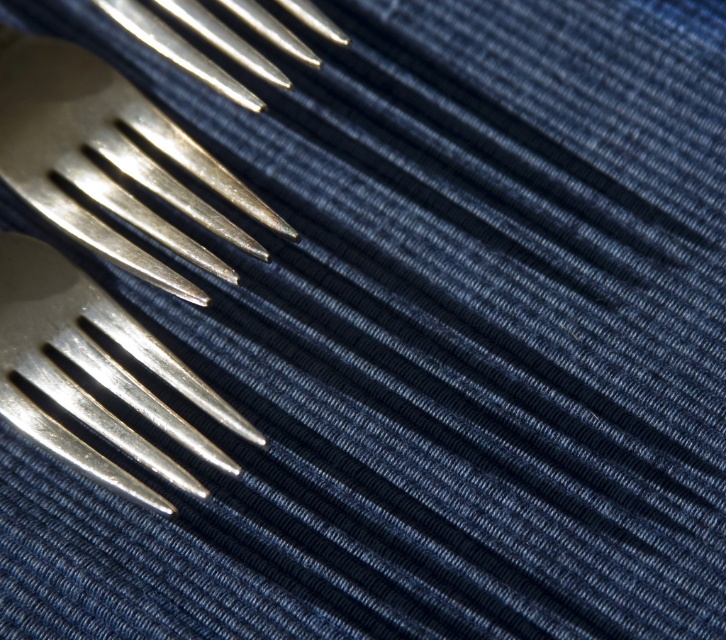
How much distance is there between polished silver fork at upper left and polished silver fork at center?

They are 5.79 inches apart.

How far apart are polished silver fork at upper left and polished silver fork at center?

polished silver fork at upper left and polished silver fork at center are 5.79 inches apart.

Is point (52, 38) less distant than point (211, 460)?

No, it is not.

At what (x,y) coordinates should I click in order to perform the action: click on polished silver fork at upper left. Please return your answer as a coordinate pair (x, y). The image size is (726, 640). Looking at the image, I should click on (110, 160).